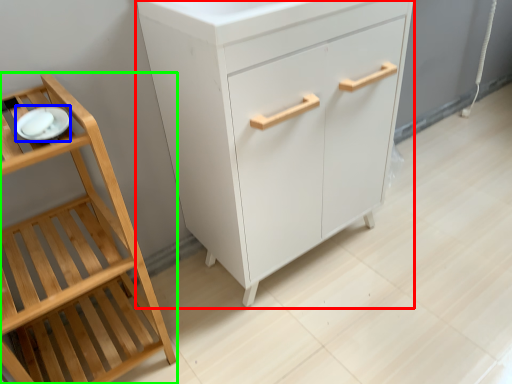
Question: Based on their relative distances, which object is farther from chest of drawers (highlighted by a red box)? Choose from tableware (highlighted by a blue box) and furniture (highlighted by a green box).

Choices:
 (A) tableware
 (B) furniture

Answer: (A)